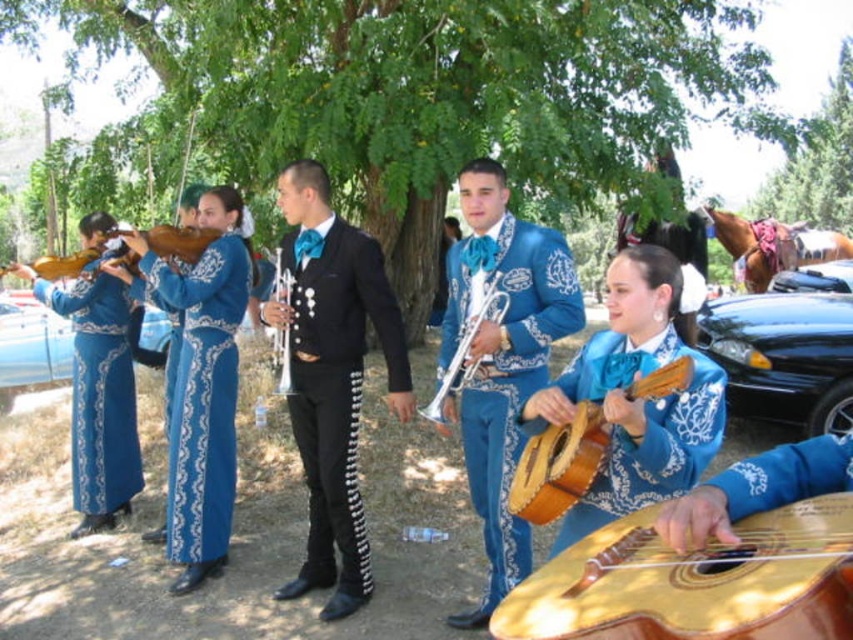
You are a photographer at the event and want to capture a photo of the blue satin guitar at center without the black glossy car at lower right appearing in the background. Is it possible to do so by adjusting your position?

The blue satin guitar at center is in front of the black glossy car at lower right, so if you position yourself directly facing the guitar and ensure the car is out of the frame behind it, it should be possible to take the photo without the car visible.

You are a photographer standing at the center of the scene. You want to take a photo that includes both the point at (225, 284) and the point at (846, 132). Which point should you focus on first to ensure both are in the frame?

You should focus on point (225, 284) first because it is closer to you than point (846, 132), ensuring both points are within the frame.